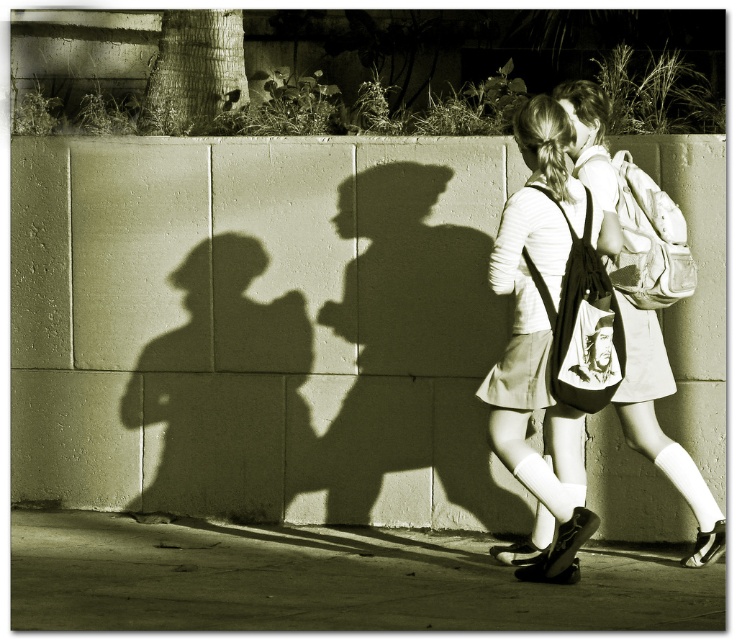
You are a photographer standing in front of the scene. You want to take a photo of the smooth concrete pavement at lower center and the smooth black hoodie at center. Which object will appear larger in your photo?

The smooth concrete pavement at lower center will appear larger in the photo because it is closer to the viewer than the smooth black hoodie at center.

You are a photographer trying to capture the two girls in the image. You want to ensure that both the matte fabric backpack at center and the smooth black hoodie at center are in focus. Given that your camera has a depth of field that can cover 12 inches, will both objects be in focus?

The distance between the matte fabric backpack at center and the smooth black hoodie at center is 11.62 inches, which is within the 12 inch depth of field. Therefore, both objects will be in focus.

You are a photographer trying to capture the shadows of the two girls and their backpacks. According to the scene description, which backpack is closer to the ground, the matte white backpack at center or the matte fabric backpack at center?

The matte white backpack at center is positioned under the matte fabric backpack at center, so the matte white backpack at center is closer to the ground.